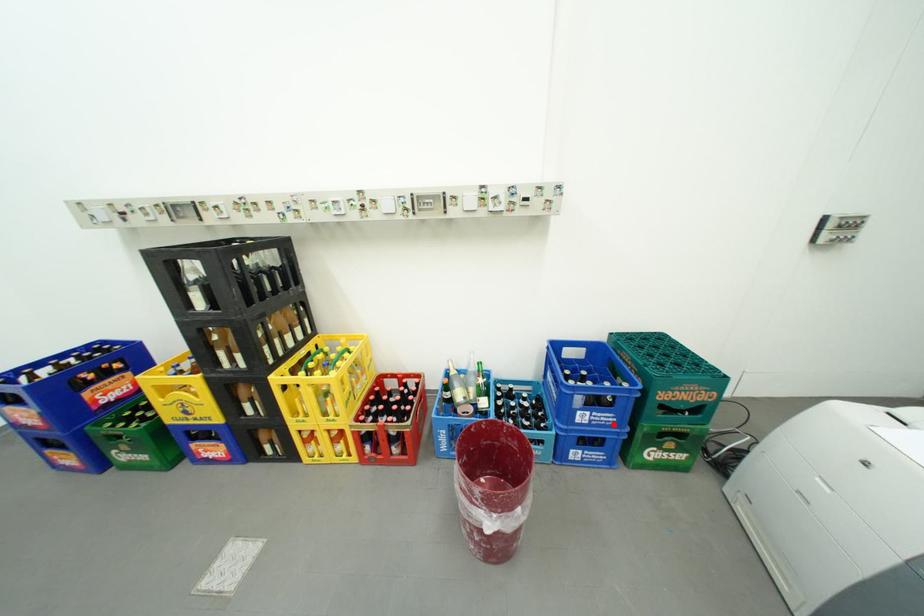
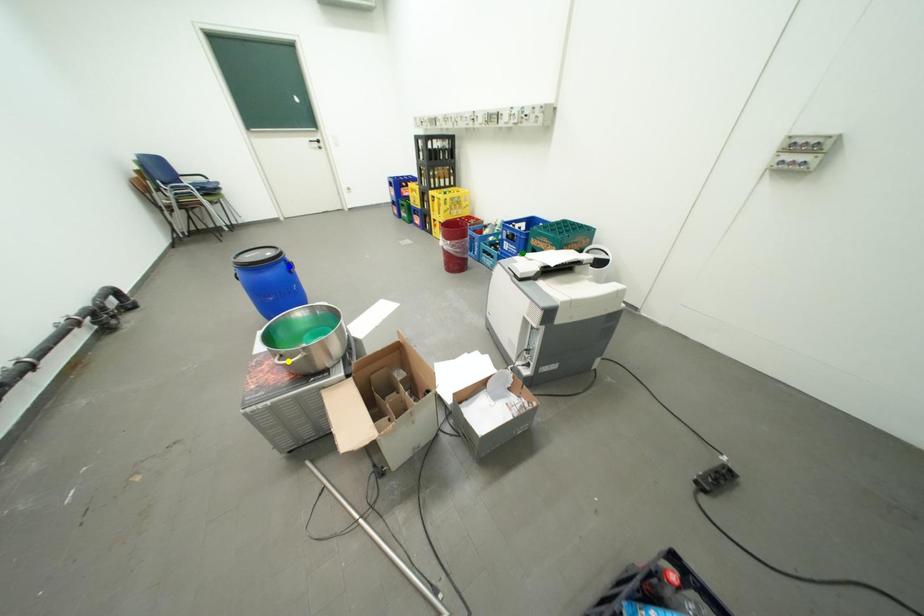
Question: I am providing you with two images of the same scene from different viewpoints. A red point is marked on the first image. You are given multiple points on the second image. Which point in image 2 represents the same 3d spot as the red point in image 1?

Choices:
 (A) green point
 (B) blue point
 (C) yellow point

Answer: (A)